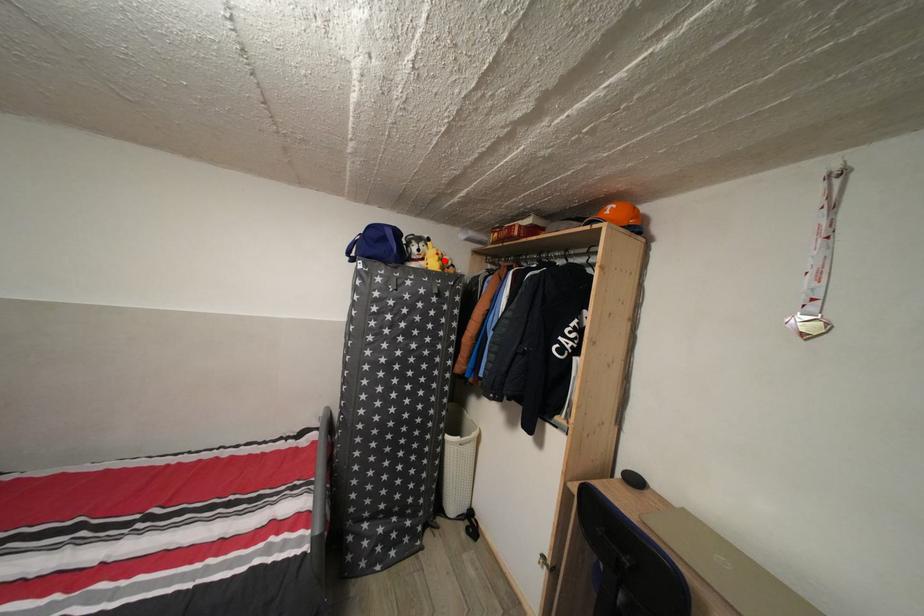
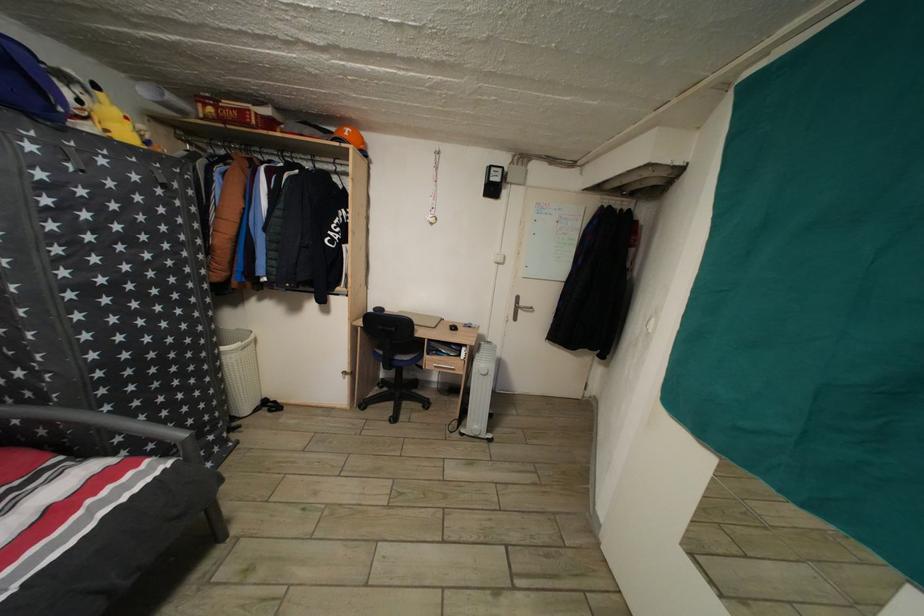
Find the pixel in the second image that matches the highlighted location in the first image.

(134, 124)